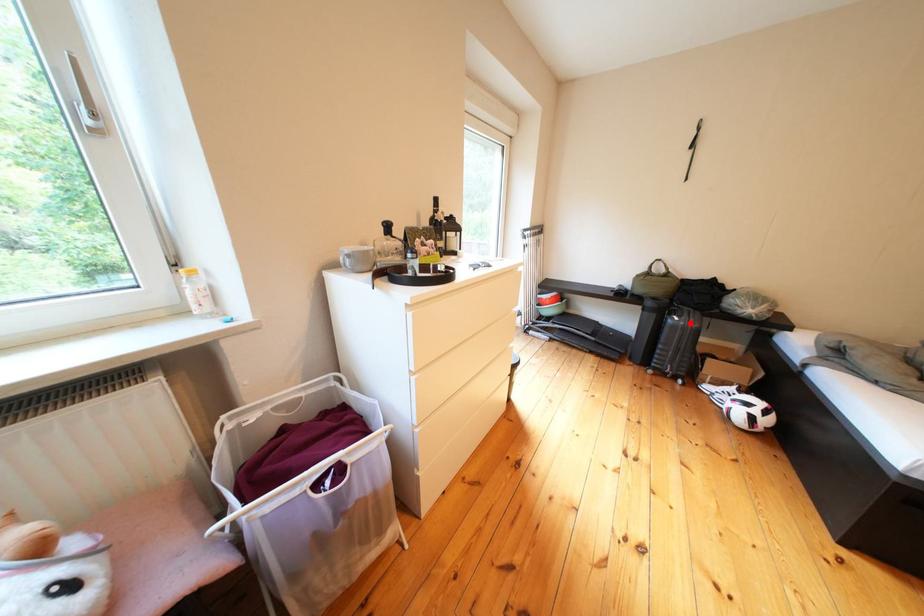
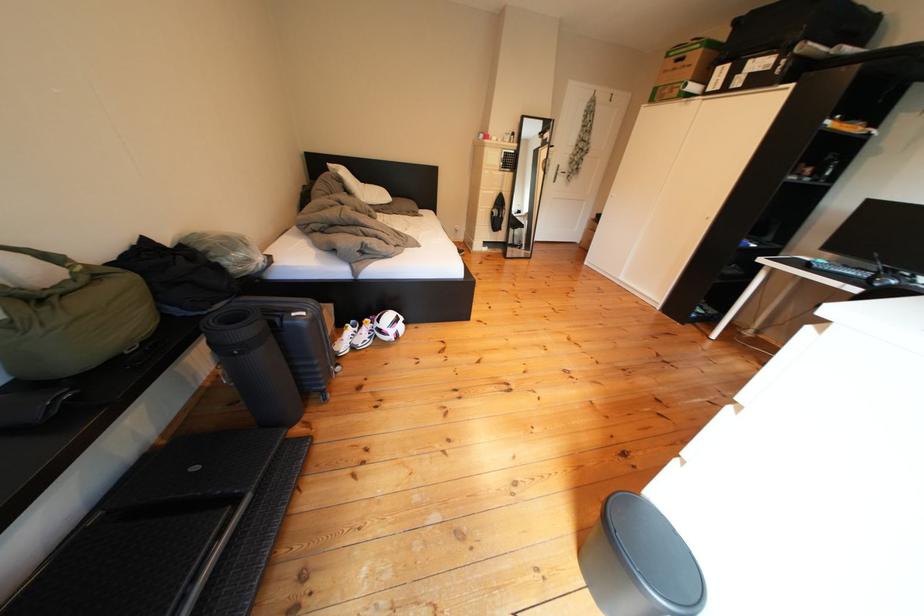
Where in the second image is the point corresponding to the highlighted location from the first image?

(317, 318)